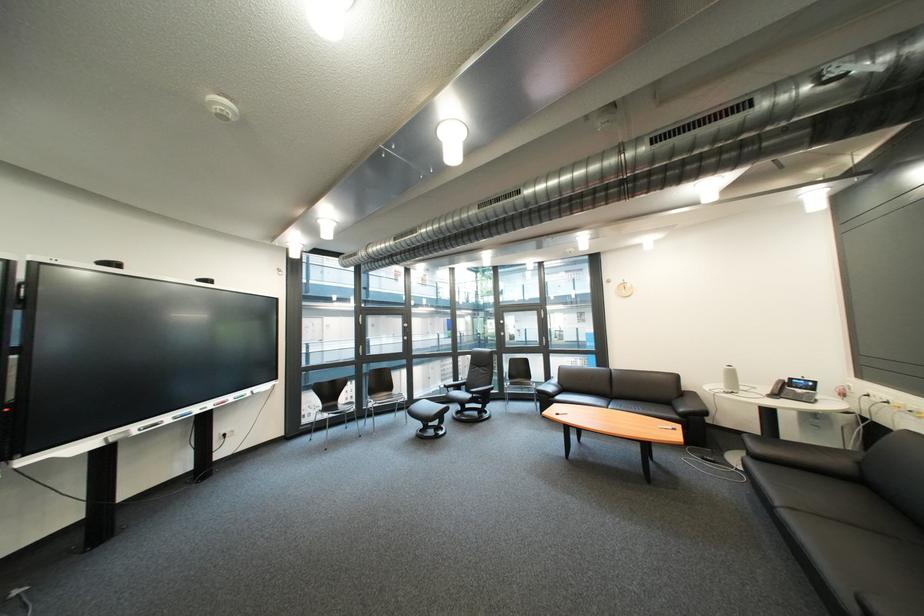
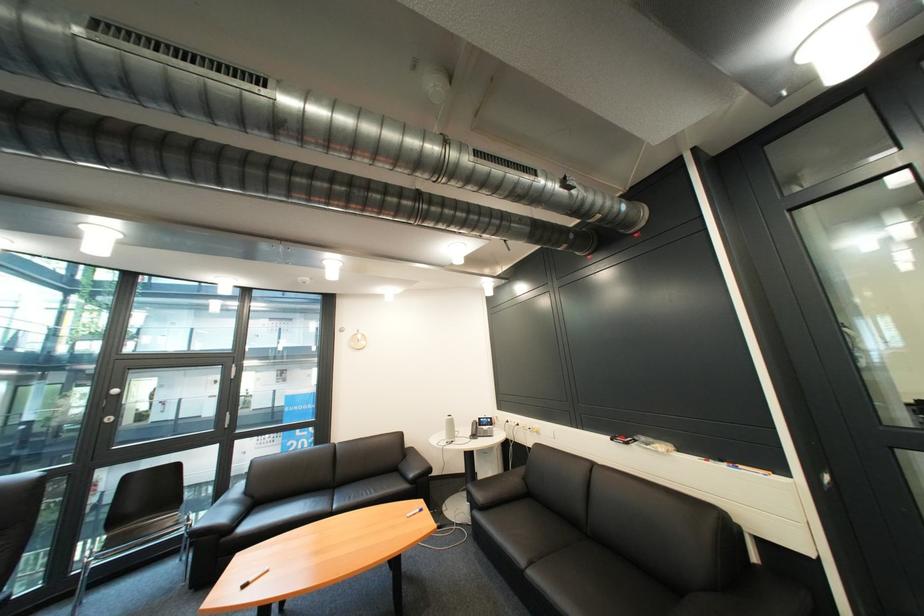
Where in the second image is the point corresponding to pixel 514 329 from the first image?

(118, 408)